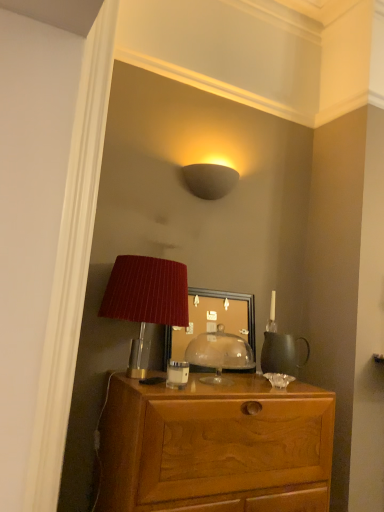
What do you see at coordinates (219, 354) in the screenshot?
I see `matte red lampshade at center` at bounding box center [219, 354].

At what (x,y) coordinates should I click in order to perform the action: click on white glossy coffee cup at center. Please return your answer as a coordinate pair (x, y). The width and height of the screenshot is (384, 512). Looking at the image, I should click on (177, 374).

This screenshot has width=384, height=512. Identify the location of matte red lampshade at center. (219, 354).

In terms of height, does wooden desk at center look taller or shorter compared to matte red lampshade at center, the first lamp ordered from the bottom?

Considering their sizes, wooden desk at center has more height than matte red lampshade at center, the first lamp ordered from the bottom.

Which object is further away from the camera, wooden desk at center or matte red lampshade at center, arranged as the second lamp when viewed from the back?

matte red lampshade at center, arranged as the second lamp when viewed from the back, is behind.

Which of these two, wooden desk at center or matte red lampshade at center, acting as the 1th lamp starting from the front, is wider?

Wider between the two is wooden desk at center.

Is point (201, 455) in front of point (159, 294)?

Yes.

Is matte red lampshade at center spatially inside white glossy coffee cup at center, or outside of it?

matte red lampshade at center is spatially situated outside white glossy coffee cup at center.

Which is behind, matte red lampshade at center or white glossy coffee cup at center?

matte red lampshade at center is further away from the camera.

Considering the relative sizes of matte red lampshade at center and white glossy coffee cup at center in the image provided, is matte red lampshade at center wider than white glossy coffee cup at center?

Correct, the width of matte red lampshade at center exceeds that of white glossy coffee cup at center.

From their relative heights in the image, would you say wooden desk at center is taller or shorter than matte gray wall sconce at upper center, the first lamp in the back-to-front sequence?

wooden desk at center is taller than matte gray wall sconce at upper center, the first lamp in the back-to-front sequence.

How different are the orientations of wooden desk at center and matte gray wall sconce at upper center, the first lamp from the top, in degrees?

The angular difference between wooden desk at center and matte gray wall sconce at upper center, the first lamp from the top, is 1.12 degrees.

Is wooden desk at center with matte gray wall sconce at upper center, positioned as the 2th lamp in front-to-back order?

No.

Is point (307, 415) less distant than point (208, 170)?

That is True.

In the scene shown: From the image's perspective, does white glossy coffee cup at center appear lower than wooden desk at center?

Incorrect, from the image's perspective, white glossy coffee cup at center is higher than wooden desk at center.

Would you say white glossy coffee cup at center is to the left or to the right of wooden desk at center in the picture?

white glossy coffee cup at center is positioned on wooden desk at center's left side.

Is white glossy coffee cup at center inside the boundaries of wooden desk at center, or outside?

white glossy coffee cup at center is not enclosed by wooden desk at center.

From the image's perspective, is matte red lampshade at center, which is the second lamp from top to bottom, on matte gray wall sconce at upper center, the first lamp in the back-to-front sequence?

Incorrect, from the image's perspective, matte red lampshade at center, which is the second lamp from top to bottom, is lower than matte gray wall sconce at upper center, the first lamp in the back-to-front sequence.

Considering the relative positions of matte red lampshade at center, the first lamp ordered from the bottom, and matte gray wall sconce at upper center, the first lamp in the back-to-front sequence, in the image provided, is matte red lampshade at center, the first lamp ordered from the bottom, to the left of matte gray wall sconce at upper center, the first lamp in the back-to-front sequence, from the viewer's perspective?

Yes, matte red lampshade at center, the first lamp ordered from the bottom, is to the left of matte gray wall sconce at upper center, the first lamp in the back-to-front sequence.

From a real-world perspective, who is located higher, matte red lampshade at center, which is the second lamp from top to bottom, or matte gray wall sconce at upper center, the first lamp in the back-to-front sequence?

matte gray wall sconce at upper center, the first lamp in the back-to-front sequence, is physically above.

In the scene shown: Would you say matte red lampshade at center, arranged as the second lamp when viewed from the back, contains matte gray wall sconce at upper center, the first lamp from the top?

Actually, matte gray wall sconce at upper center, the first lamp from the top, is outside matte red lampshade at center, arranged as the second lamp when viewed from the back.

Is wooden desk at center looking in the opposite direction of matte red lampshade at center?

No, matte red lampshade at center is not at the back of wooden desk at center.

Is wooden desk at center further to the viewer compared to matte red lampshade at center?

No, it is not.

Does wooden desk at center have a greater height compared to matte red lampshade at center?

Correct, wooden desk at center is much taller as matte red lampshade at center.

From the image's perspective, is wooden desk at center beneath matte red lampshade at center?

Correct, wooden desk at center appears lower than matte red lampshade at center in the image.

In terms of size, does matte red lampshade at center appear bigger or smaller than matte glass mirror at center?

Considering their sizes, matte red lampshade at center takes up less space than matte glass mirror at center.

From a real-world perspective, relative to matte glass mirror at center, is matte red lampshade at center vertically above or below?

From a real-world perspective, matte red lampshade at center is physically below matte glass mirror at center.

Between matte red lampshade at center and matte glass mirror at center, which one has more height?

With more height is matte glass mirror at center.

Can you tell me how much matte red lampshade at center and matte glass mirror at center differ in facing direction?

They differ by 1.98 degrees in their facing directions.

Find the location of a particular element. desk in front of the matte red lampshade at center, the first lamp ordered from the bottom is located at coordinates (215, 447).

Where is `coffee cup below the matte red lampshade at center (from a real-world perspective)`? The image size is (384, 512). coffee cup below the matte red lampshade at center (from a real-world perspective) is located at coordinates (177, 374).

From the image, which object appears to be farther from white glossy coffee cup at center, matte gray wall sconce at upper center, the first lamp from the top, or matte red lampshade at center?

Among the two, matte gray wall sconce at upper center, the first lamp from the top, is located further to white glossy coffee cup at center.

When comparing their distances from matte red lampshade at center, the first lamp ordered from the bottom, does wooden desk at center or matte gray wall sconce at upper center, the 2th lamp in the bottom-to-top sequence, seem closer?

Based on the image, wooden desk at center appears to be nearer to matte red lampshade at center, the first lamp ordered from the bottom.

Which object lies further to the anchor point matte glass mirror at center, matte red lampshade at center or matte gray wall sconce at upper center, the first lamp in the back-to-front sequence?

matte gray wall sconce at upper center, the first lamp in the back-to-front sequence, is positioned further to the anchor matte glass mirror at center.

Which object lies nearer to the anchor point matte red lampshade at center, arranged as the second lamp when viewed from the back, wooden desk at center or white glossy coffee cup at center?

white glossy coffee cup at center.

Which object lies nearer to the anchor point matte gray wall sconce at upper center, positioned as the 2th lamp in front-to-back order, matte glass mirror at center or matte red lampshade at center, acting as the 1th lamp starting from the front?

matte glass mirror at center.

Based on their spatial positions, is white glossy coffee cup at center or matte red lampshade at center further from matte glass mirror at center?

The object further to matte glass mirror at center is white glossy coffee cup at center.

Considering their positions, is matte gray wall sconce at upper center, the 2th lamp in the bottom-to-top sequence, positioned closer to white glossy coffee cup at center than matte glass mirror at center?

matte glass mirror at center.

When comparing their distances from matte red lampshade at center, the first lamp ordered from the bottom, does matte gray wall sconce at upper center, the first lamp from the top, or white glossy coffee cup at center seem closer?

Based on the image, white glossy coffee cup at center appears to be nearer to matte red lampshade at center, the first lamp ordered from the bottom.

What are the coordinates of `lamp that lies between matte gray wall sconce at upper center, the 2th lamp in the bottom-to-top sequence, and matte red lampshade at center from top to bottom` in the screenshot? It's located at (146, 298).

Locate an element on the screen. The height and width of the screenshot is (512, 384). table lamp between wooden desk at center and matte glass mirror at center from front to back is located at coordinates (219, 354).

Find the location of a particular element. mirror that lies between matte gray wall sconce at upper center, the first lamp from the top, and wooden desk at center from top to bottom is located at coordinates (223, 311).

This screenshot has height=512, width=384. Identify the location of lamp that lies between matte gray wall sconce at upper center, positioned as the 2th lamp in front-to-back order, and white glossy coffee cup at center from top to bottom. (146, 298).